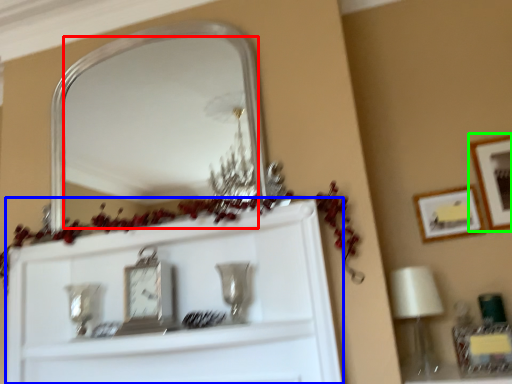
Question: Considering the real-world distances, which object is farthest from mirror (highlighted by a red box)? cabinet (highlighted by a blue box) or picture frame (highlighted by a green box)?

Choices:
 (A) cabinet
 (B) picture frame

Answer: (B)